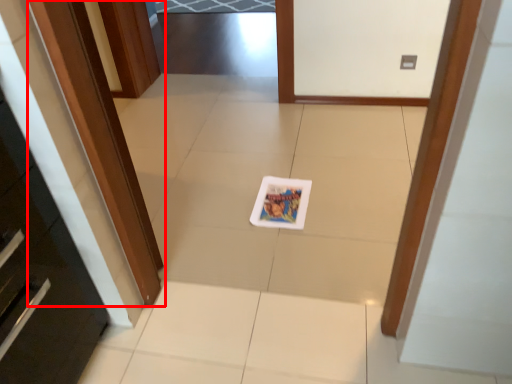
Question: Where is door (annotated by the red box) located in relation to postcard in the image?

Choices:
 (A) left
 (B) right

Answer: (A)